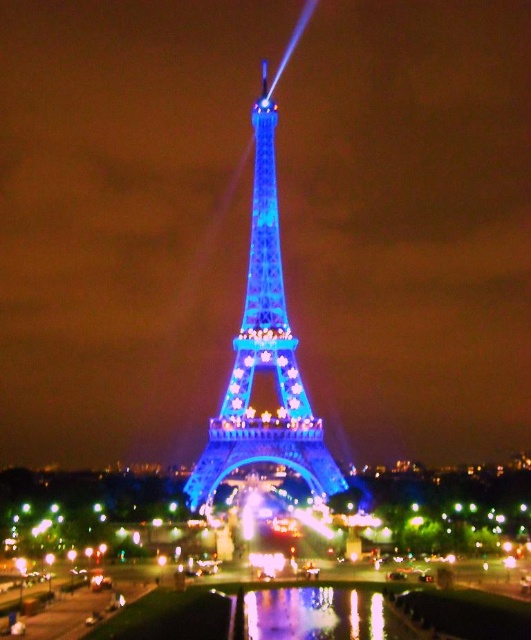
Question: Does blue glass bridge at center have a larger size compared to blue illuminated metal eiffel tower at center?

Choices:
 (A) yes
 (B) no

Answer: (B)

Question: Is blue glass bridge at center smaller than blue illuminated metal eiffel tower at center?

Choices:
 (A) no
 (B) yes

Answer: (B)

Question: Is blue glass bridge at center further to the viewer compared to blue illuminated metal eiffel tower at center?

Choices:
 (A) no
 (B) yes

Answer: (B)

Question: Which point is closer to the camera taking this photo?

Choices:
 (A) (272, 243)
 (B) (29, 518)

Answer: (B)